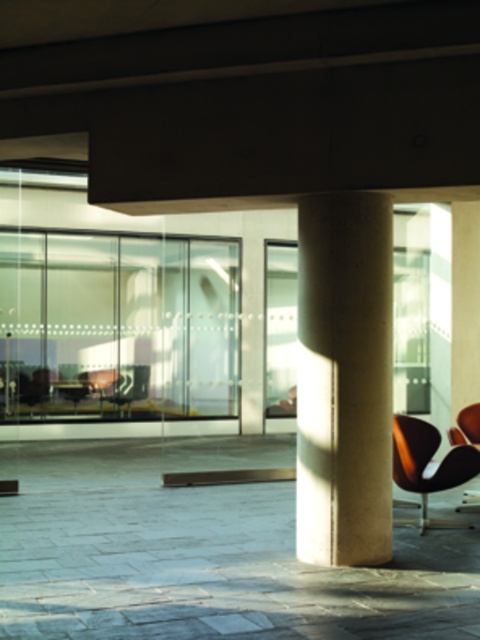
Question: Among these objects, which one is nearest to the camera?

Choices:
 (A) transparent glass door at center
 (B) smooth concrete pillar at center
 (C) brown leather armchair at lower right

Answer: (B)

Question: In this image, where is smooth concrete pillar at center located relative to brown leather armchair at lower right?

Choices:
 (A) below
 (B) above

Answer: (B)

Question: Which object is positioned closest to the transparent glass door at center?

Choices:
 (A) smooth concrete pillar at center
 (B) brown leather armchair at lower right

Answer: (B)

Question: Which point is farther to the camera?

Choices:
 (A) pos(12,248)
 (B) pos(363,412)
 (C) pos(457,465)

Answer: (A)

Question: Can you confirm if smooth concrete pillar at center is positioned above brown leather armchair at lower right?

Choices:
 (A) yes
 (B) no

Answer: (A)

Question: Can you confirm if smooth concrete pillar at center is positioned to the right of brown leather armchair at lower right?

Choices:
 (A) no
 (B) yes

Answer: (A)